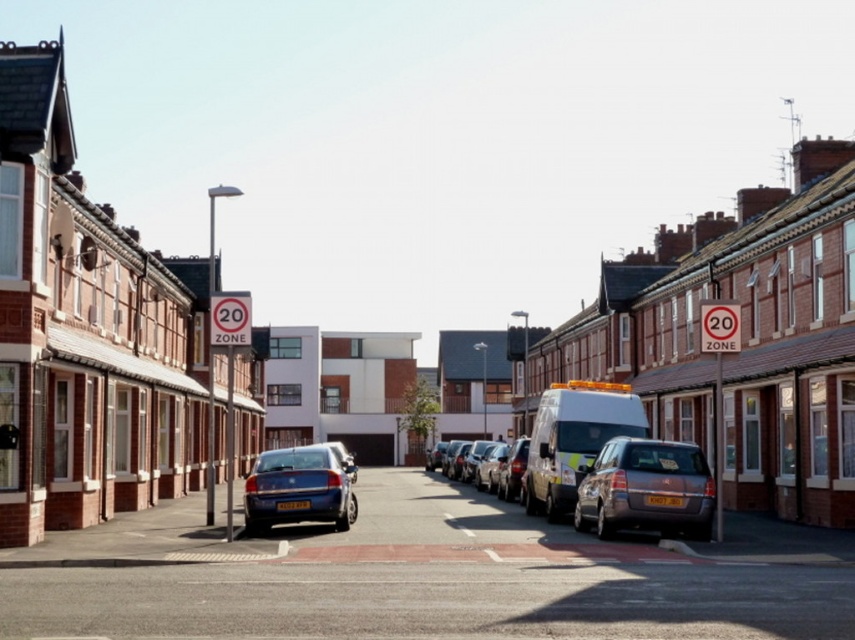
Does silver metallic estate car at center appear on the left side of shiny silver van at center?

No, silver metallic estate car at center is not to the left of shiny silver van at center.

Who is positioned more to the left, silver metallic estate car at center or shiny silver van at center?

shiny silver van at center is more to the left.

Identify the location of silver metallic estate car at center. (646, 490).

From the picture: Who is more distant from viewer, [593,492] or [529,442]?

Positioned behind is point [529,442].

Who is positioned more to the left, silver metallic estate car at center or white glossy van at center?

Positioned to the left is white glossy van at center.

Does point (684, 472) come behind point (578, 435)?

No, it is not.

Where is `silver metallic estate car at center`? silver metallic estate car at center is located at coordinates (646, 490).

Locate an element on the screen. blue metallic car at center is located at coordinates (299, 488).

The width and height of the screenshot is (855, 640). Describe the element at coordinates (299, 488) in the screenshot. I see `blue metallic car at center` at that location.

At what (x,y) coordinates should I click in order to perform the action: click on blue metallic car at center. Please return your answer as a coordinate pair (x, y). This screenshot has width=855, height=640. Looking at the image, I should click on (299, 488).